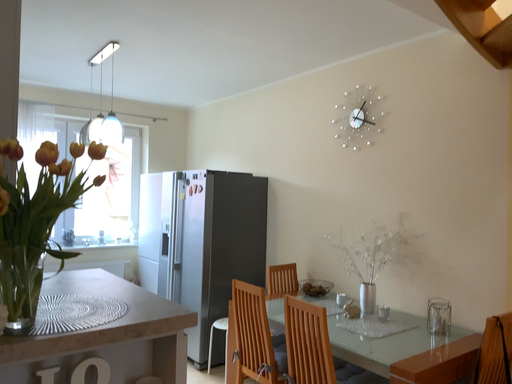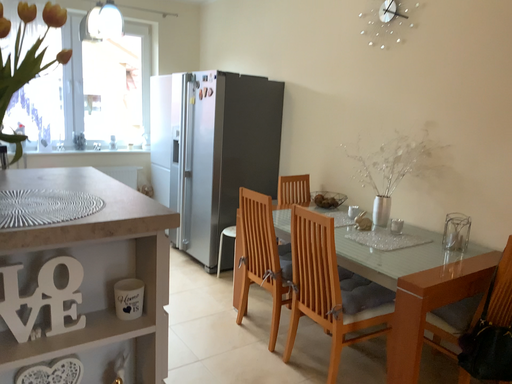
Question: Which way did the camera rotate in the video?

Choices:
 (A) rotated downward
 (B) rotated upward

Answer: (A)